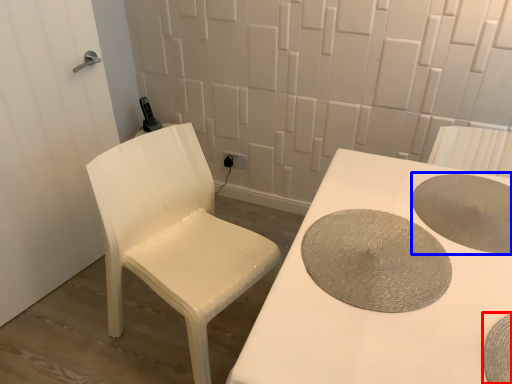
Question: Which object appears closest to the camera in this image, manhole cover (highlighted by a red box) or manhole cover (highlighted by a blue box)?

Choices:
 (A) manhole cover
 (B) manhole cover

Answer: (A)